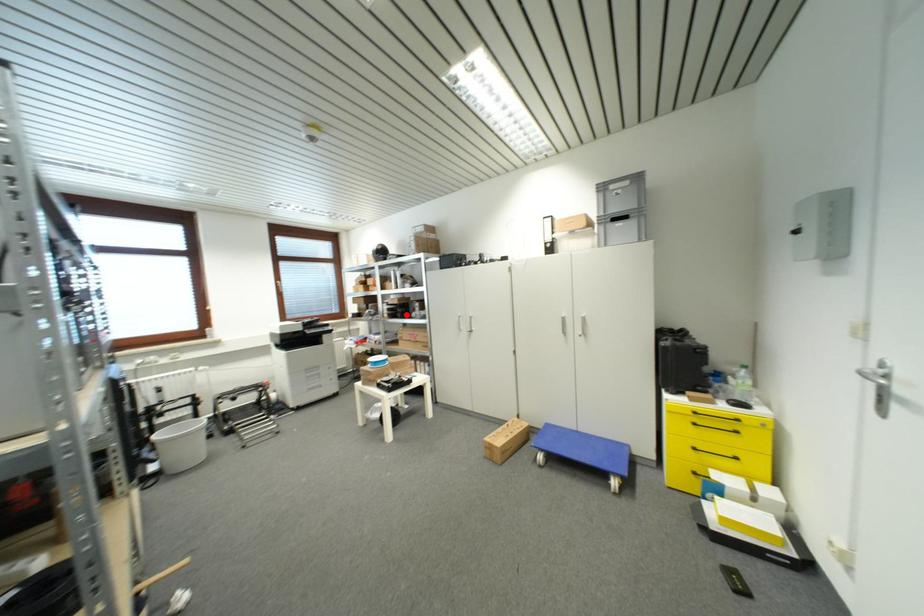
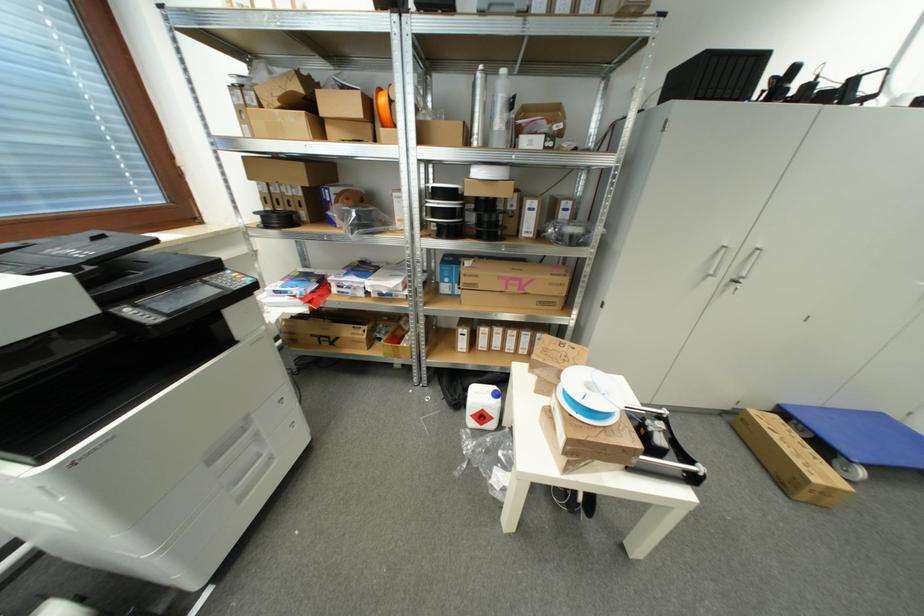
Where in the second image is the point corresponding to the highlighted location from the first image?

(493, 225)